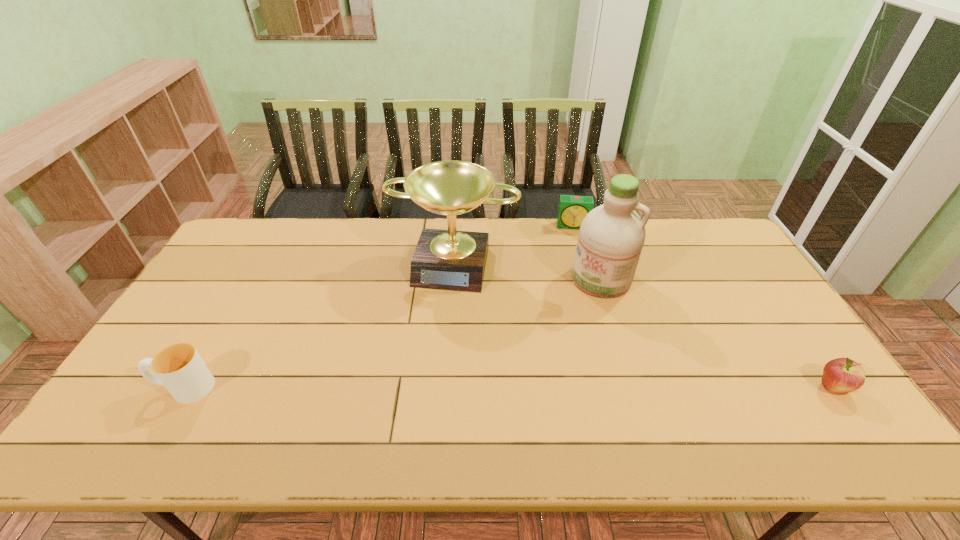
You are a GUI agent. You are given a task and a screenshot of the screen. Output one action in this format:
    pyautogui.click(x=<x>, y=<y>)
    Task: Click on the apple located in the near edge section of the desktop
    
    Given the screenshot: What is the action you would take?
    pos(842,375)

The width and height of the screenshot is (960, 540). I want to click on object located at the left edge, so click(x=179, y=367).

The width and height of the screenshot is (960, 540). In order to click on object that is at the right edge in this screenshot , I will do click(x=842, y=375).

Identify the location of object located in the near left corner section of the desktop. The image size is (960, 540). (179, 367).

Where is `object that is at the near right corner`? object that is at the near right corner is located at coordinates (842, 375).

In the image, there is a desktop. Where is `vacant space at the far edge`? vacant space at the far edge is located at coordinates (508, 228).

Locate an element on the screen. Image resolution: width=960 pixels, height=540 pixels. free space at the near edge of the desktop is located at coordinates 476,388.

The width and height of the screenshot is (960, 540). Identify the location of free space at the left edge. (213, 325).

The width and height of the screenshot is (960, 540). In the image, there is a desktop. What are the coordinates of `vacant space at the far left corner` in the screenshot? It's located at (253, 226).

Find the location of a particular element. The width and height of the screenshot is (960, 540). free location at the near right corner of the desktop is located at coordinates (801, 387).